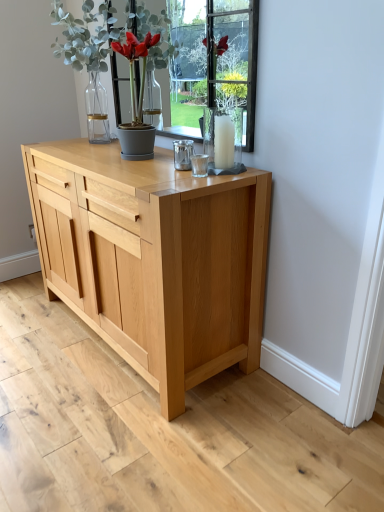
Question: Visually, is green matte plant at upper center positioned to the left or to the right of clear glass candle at center?

Choices:
 (A) right
 (B) left

Answer: (B)

Question: From the image's perspective, is green matte plant at upper center positioned above or below clear glass candle at center?

Choices:
 (A) below
 (B) above

Answer: (B)

Question: Which is nearer to the clear glass candle at center?

Choices:
 (A) natural wood chest of drawers at center
 (B) green matte plant at upper center

Answer: (B)

Question: Based on their relative distances, which object is nearer to the natural wood chest of drawers at center?

Choices:
 (A) clear glass candle at center
 (B) green matte plant at upper center

Answer: (A)